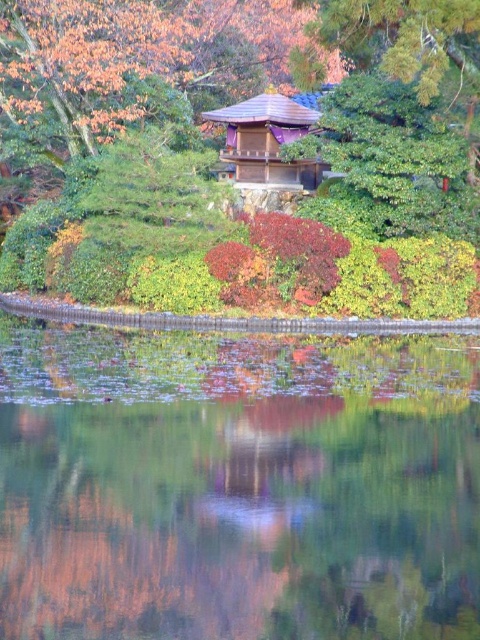
Question: Which object appears farthest from the camera in this image?

Choices:
 (A) transparent glass water at center
 (B) wooden shingled hut at center

Answer: (B)

Question: Does transparent glass water at center appear over green leafy bush at upper center?

Choices:
 (A) no
 (B) yes

Answer: (A)

Question: Which is farther from the transparent glass water at center?

Choices:
 (A) wooden shingled hut at center
 (B) green leafy bush at upper center

Answer: (A)

Question: Can you confirm if transparent glass water at center is smaller than wooden shingled hut at center?

Choices:
 (A) no
 (B) yes

Answer: (A)

Question: Does green leafy bush at upper center have a lesser width compared to wooden shingled hut at center?

Choices:
 (A) no
 (B) yes

Answer: (A)

Question: Estimate the real-world distances between objects in this image. Which object is closer to the green leafy bush at upper center?

Choices:
 (A) wooden shingled hut at center
 (B) transparent glass water at center

Answer: (A)